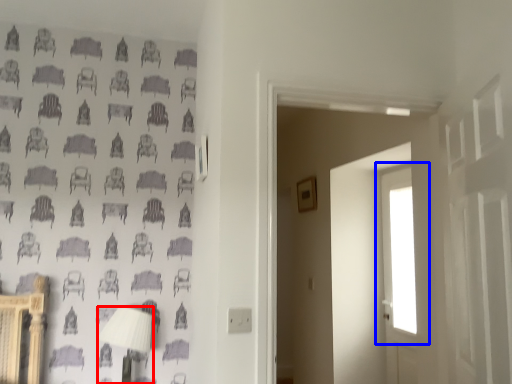
Question: Which point is closer to the camera, table lamp (highlighted by a red box) or window (highlighted by a blue box)?

Choices:
 (A) table lamp
 (B) window

Answer: (A)